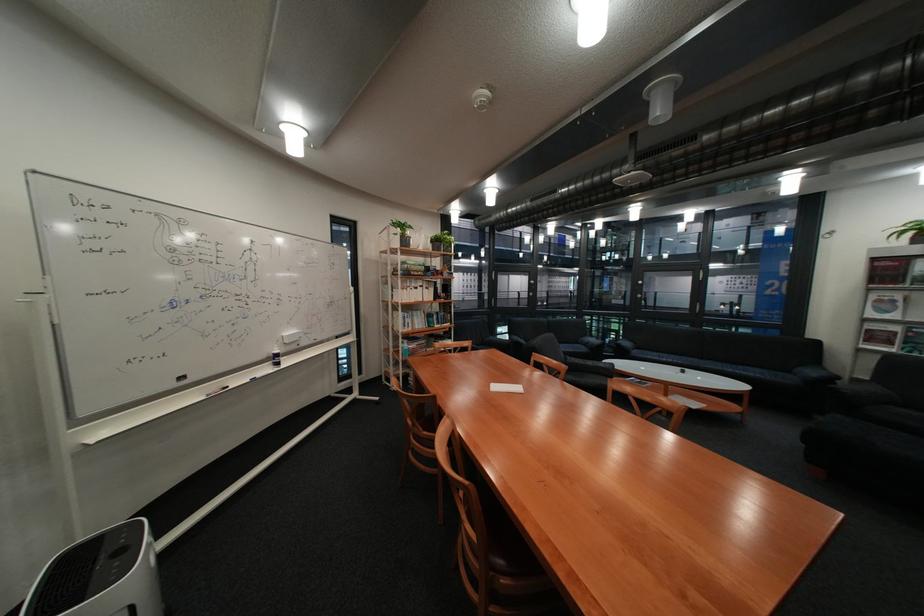
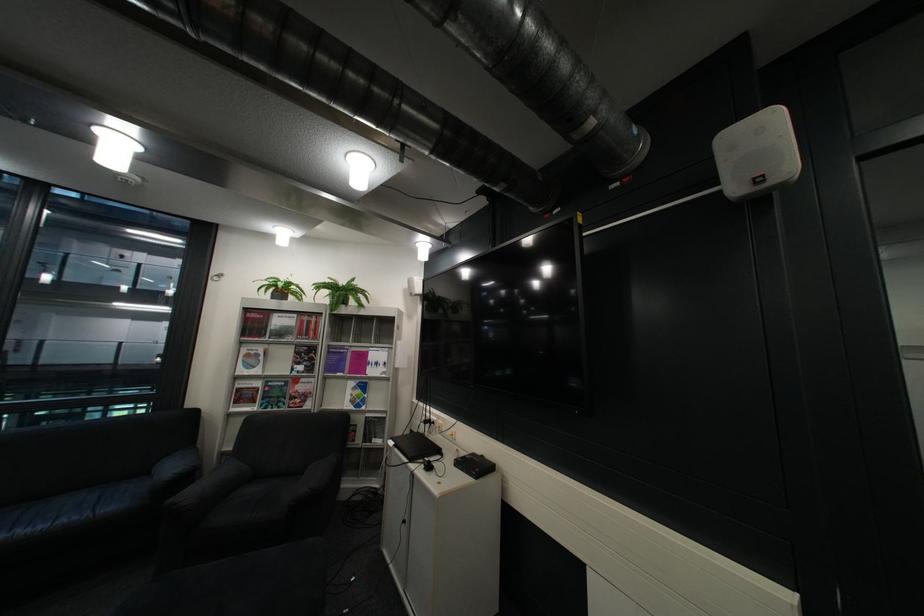
Locate, in the second image, the point that corresponds to [827,371] in the first image.

(186, 468)